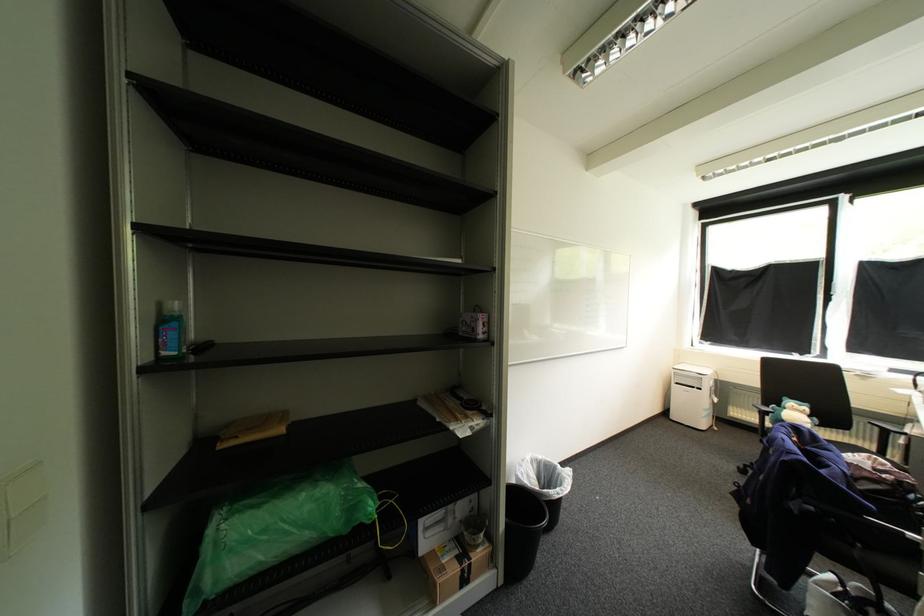
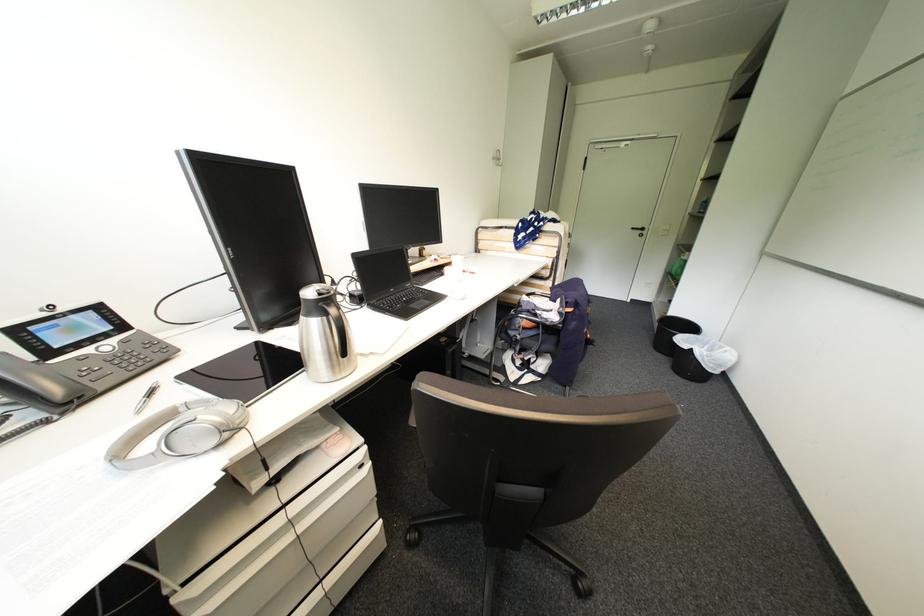
Find the pixel in the second image that matches the point at 513,517 in the first image.

(675, 313)